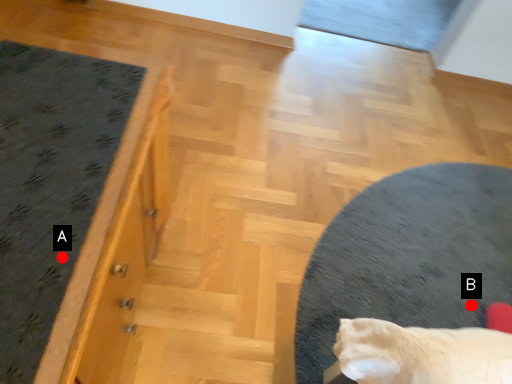
Question: Two points are circled on the image, labeled by A and B beside each circle. Which point is farther from the camera taking this photo?

Choices:
 (A) A is further
 (B) B is further

Answer: (B)